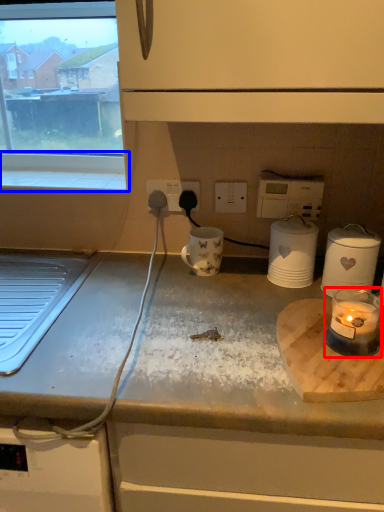
Question: Among these objects, which one is nearest to the camera, candle holder (highlighted by a red box) or window sill (highlighted by a blue box)?

Choices:
 (A) candle holder
 (B) window sill

Answer: (A)